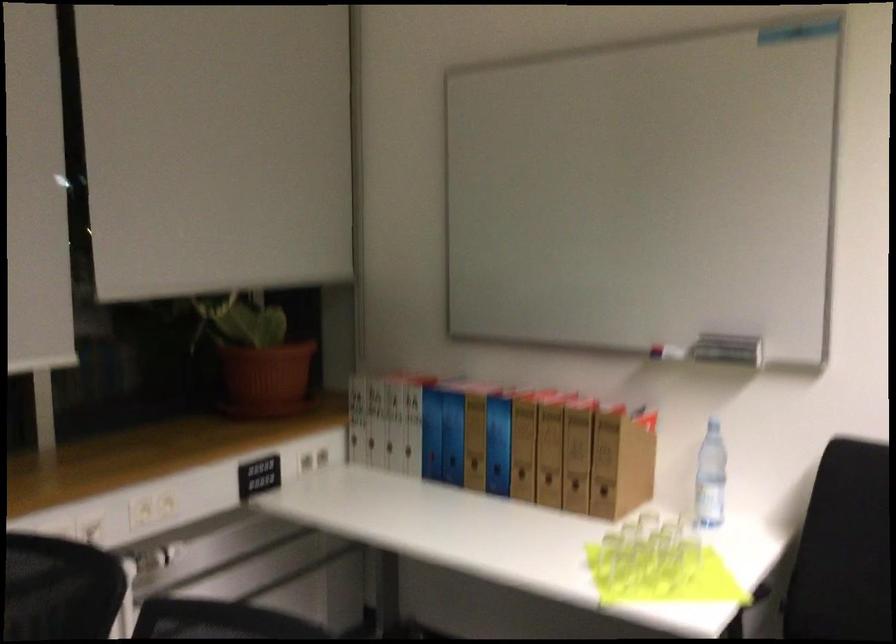
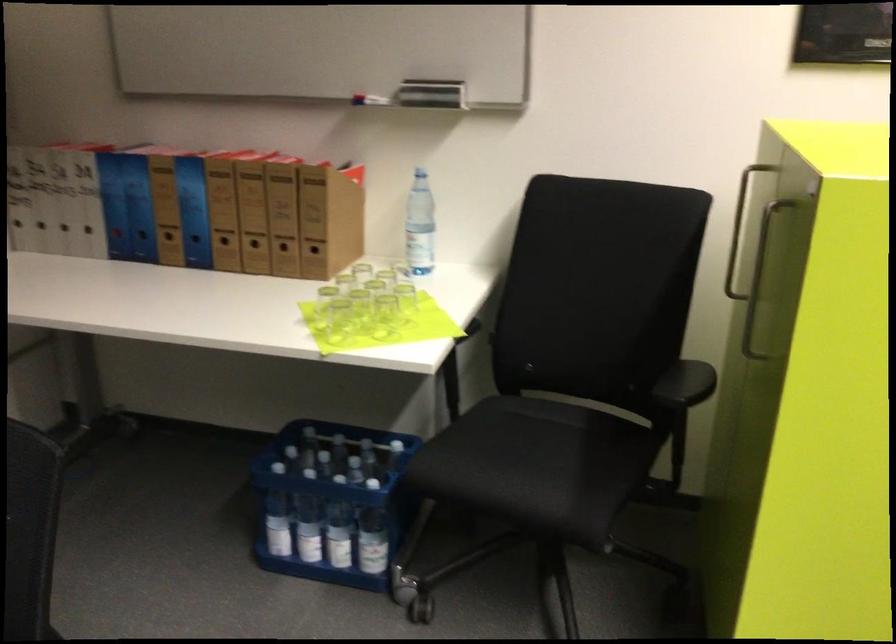
In the second image, find the point that corresponds to (x=713, y=475) in the first image.

(419, 225)